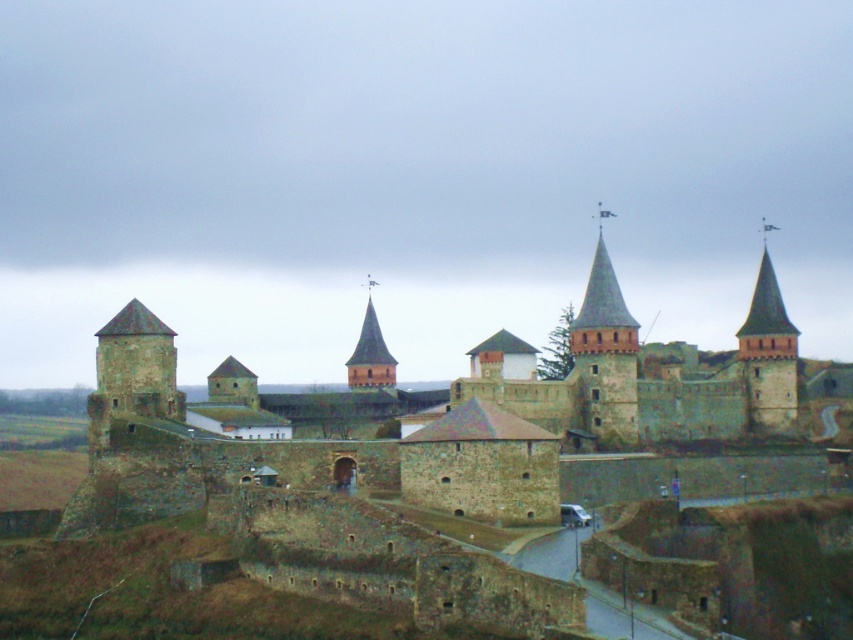
You are a medieval knight approaching the castle from the paved road. You notice a smooth stone spire at upper right. Can you determine the direction you should walk to reach it from your current position at point [602,307]?

The smooth stone spire at upper right is located at point [602,307], so you are already at the spire.

You are a traveler approaching the castle from the paved road in the lower part of the image. According to the map, there is a hidden treasure located at point (405, 417). Which object in the scene corresponds to this coordinate?

The point (405, 417) marks the rustic stone castle at center.

You are a knight approaching the castle and need to enter through the main gate. From your vantage point on the paved road below, which object is closer to you, the rustic stone castle at center or the brick stonework tower at center?

The rustic stone castle at center is positioned under the brick stonework tower at center, so the brick stonework tower at center is closer to you as you approach from the road below.